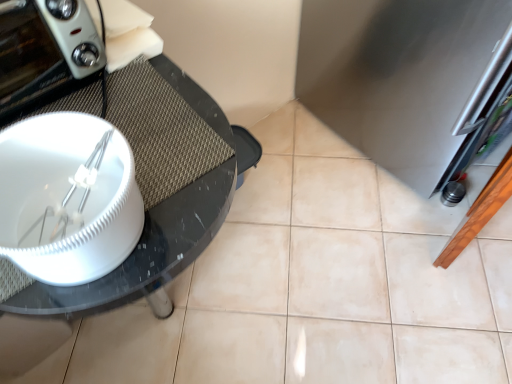
Question: From the image's perspective, is stainless steel refrigerator at right positioned above or below matte white toaster at left?

Choices:
 (A) above
 (B) below

Answer: (A)

Question: Would you say stainless steel refrigerator at right is to the left or to the right of matte white toaster at left in the picture?

Choices:
 (A) right
 (B) left

Answer: (A)

Question: Which is nearer to the matte white toaster at left?

Choices:
 (A) stainless steel refrigerator at right
 (B) black glossy glass table at left

Answer: (B)

Question: Which is nearer to the stainless steel refrigerator at right?

Choices:
 (A) black glossy glass table at left
 (B) matte white toaster at left

Answer: (A)